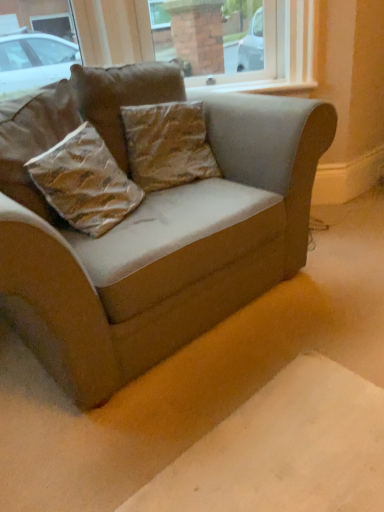
Question: Is brown textured pillow at center, which appears as the 1th pillow when viewed from the top, bigger or smaller than brown textured pillow at center, the 2th pillow from the top?

Choices:
 (A) small
 (B) big

Answer: (A)

Question: Considering the positions of point (115, 81) and point (145, 129), is point (115, 81) closer or farther from the camera than point (145, 129)?

Choices:
 (A) closer
 (B) farther

Answer: (A)

Question: Based on their relative distances, which object is nearer to the brown textured pillow at center, which is counted as the 2th pillow, starting from the bottom?

Choices:
 (A) brown textured pillow at center, which appears as the 1th pillow when viewed from the top
 (B) velvet beige couch at center
 (C) brown textured pillow at center, the first pillow when ordered from bottom to top

Answer: (A)

Question: Estimate the real-world distances between objects in this image. Which object is closer to the velvet beige couch at center?

Choices:
 (A) brown textured pillow at center, the 3th pillow ordered from the bottom
 (B) brown textured pillow at center, the first pillow when ordered from bottom to top
 (C) brown textured pillow at center, which is counted as the 2th pillow, starting from the bottom

Answer: (B)